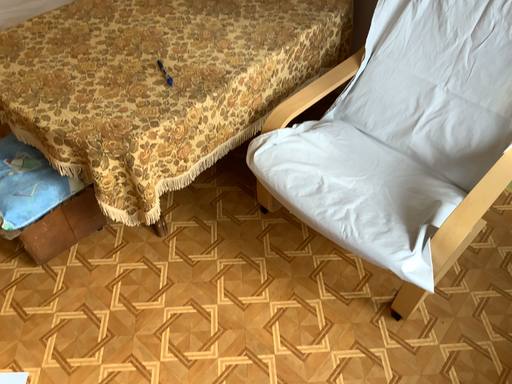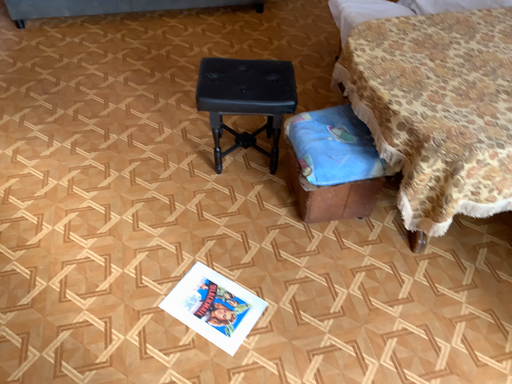
Question: Which way did the camera rotate in the video?

Choices:
 (A) rotated downward
 (B) rotated upward

Answer: (B)